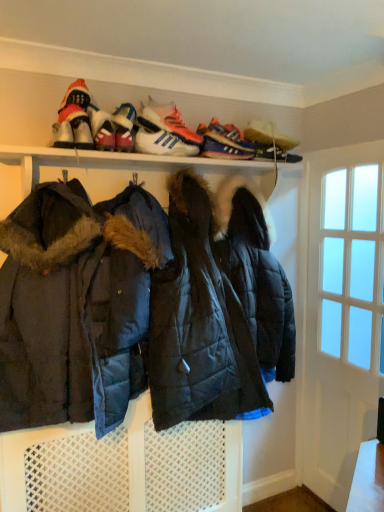
Question: Does dark blue quilted jacket at center lie in front of shiny pink sneaker at upper center, which is the 4th footwear from right to left?

Choices:
 (A) yes
 (B) no

Answer: (A)

Question: Considering the relative sizes of dark blue quilted jacket at center and shiny pink sneaker at upper center, acting as the second footwear starting from the left, in the image provided, is dark blue quilted jacket at center taller than shiny pink sneaker at upper center, acting as the second footwear starting from the left,?

Choices:
 (A) yes
 (B) no

Answer: (A)

Question: Would you say dark blue quilted jacket at center is a long distance from shiny pink sneaker at upper center, which is the 4th footwear from right to left?

Choices:
 (A) no
 (B) yes

Answer: (A)

Question: From the image's perspective, is dark blue quilted jacket at center on shiny pink sneaker at upper center, which is the 4th footwear from right to left?

Choices:
 (A) yes
 (B) no

Answer: (B)

Question: Is dark blue quilted jacket at center at the right side of shiny pink sneaker at upper center, which is the 4th footwear from right to left?

Choices:
 (A) no
 (B) yes

Answer: (B)

Question: Does dark blue quilted jacket at center have a lesser height compared to shiny pink sneaker at upper center, which is the 4th footwear from right to left?

Choices:
 (A) no
 (B) yes

Answer: (A)

Question: Is white glass door at right touching white leather sneakers at upper center, which ranks as the fourth footwear in left-to-right order?

Choices:
 (A) yes
 (B) no

Answer: (B)

Question: Does white glass door at right lie in front of white leather sneakers at upper center, acting as the second footwear starting from the right?

Choices:
 (A) no
 (B) yes

Answer: (A)

Question: Is white glass door at right further to the viewer compared to white leather sneakers at upper center, which ranks as the fourth footwear in left-to-right order?

Choices:
 (A) no
 (B) yes

Answer: (B)

Question: Does white glass door at right have a larger size compared to white leather sneakers at upper center, acting as the second footwear starting from the right?

Choices:
 (A) yes
 (B) no

Answer: (A)

Question: From a real-world perspective, is white glass door at right over white leather sneakers at upper center, acting as the second footwear starting from the right?

Choices:
 (A) yes
 (B) no

Answer: (B)

Question: Considering the relative sizes of white glass door at right and white leather sneakers at upper center, which ranks as the fourth footwear in left-to-right order, in the image provided, is white glass door at right taller than white leather sneakers at upper center, which ranks as the fourth footwear in left-to-right order,?

Choices:
 (A) no
 (B) yes

Answer: (B)

Question: From the image's perspective, is purple suede sneaker at upper center, the second shoe positioned from the left, located beneath white leather sneakers at upper center, the third footwear positioned from the right?

Choices:
 (A) yes
 (B) no

Answer: (B)